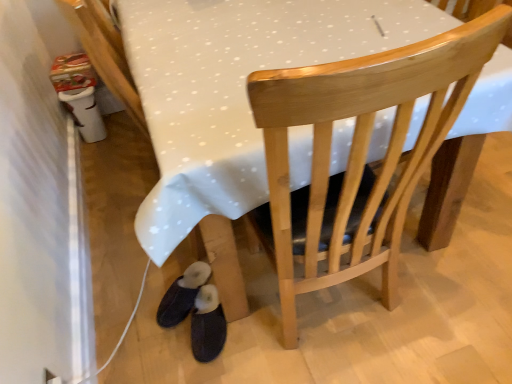
This screenshot has height=384, width=512. In order to click on vacant space to the left of dark blue fabric slippers at lower left, marked as the 1th footwear in a right-to-left arrangement in this screenshot , I will do `click(154, 336)`.